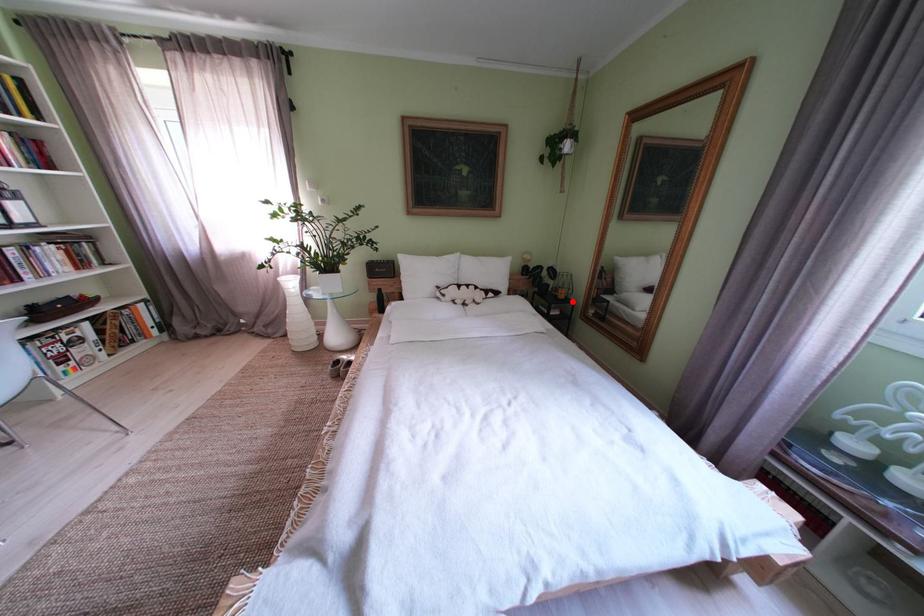
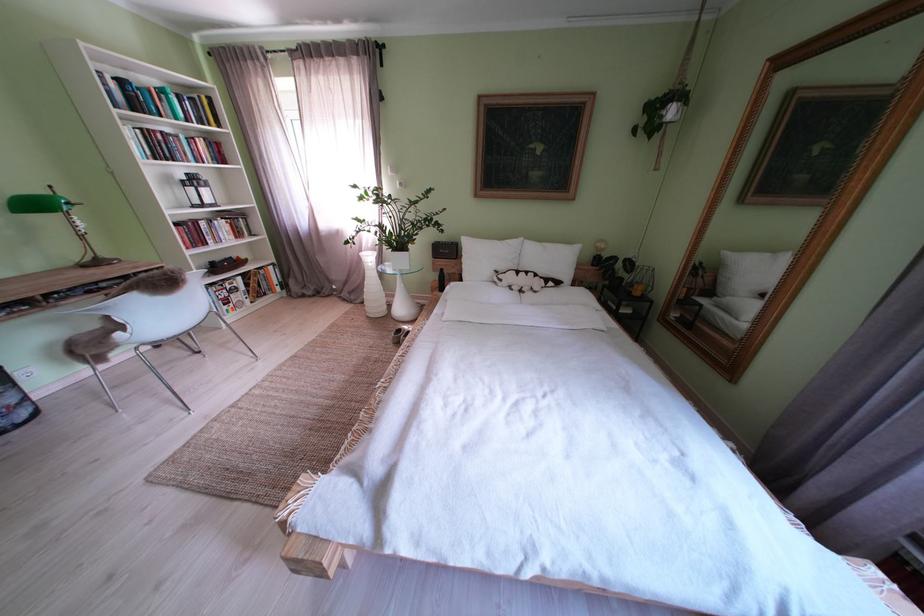
The point at the highlighted location is marked in the first image. Where is the corresponding point in the second image?

(648, 299)